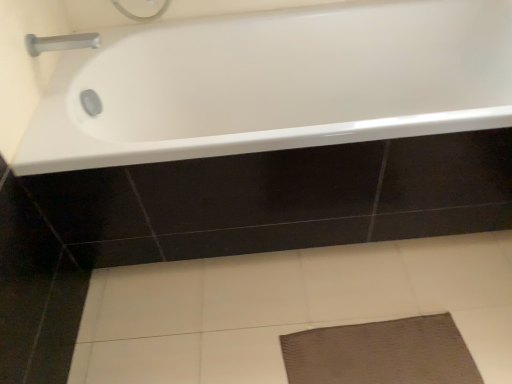
Question: Is white glossy bathtub at upper center in front of or behind silver metallic tap at upper left in the image?

Choices:
 (A) behind
 (B) front

Answer: (B)

Question: From a real-world perspective, is white glossy bathtub at upper center above or below silver metallic tap at upper left?

Choices:
 (A) above
 (B) below

Answer: (B)

Question: From the image's perspective, is white glossy bathtub at upper center positioned above or below silver metallic tap at upper left?

Choices:
 (A) above
 (B) below

Answer: (B)

Question: Considering the positions of silver metallic tap at upper left and white glossy bathtub at upper center in the image, is silver metallic tap at upper left wider or thinner than white glossy bathtub at upper center?

Choices:
 (A) thin
 (B) wide

Answer: (A)

Question: Considering their positions, is silver metallic tap at upper left located in front of or behind white glossy bathtub at upper center?

Choices:
 (A) front
 (B) behind

Answer: (B)

Question: Considering the relative positions of silver metallic tap at upper left and white glossy bathtub at upper center in the image provided, is silver metallic tap at upper left to the left or to the right of white glossy bathtub at upper center?

Choices:
 (A) left
 (B) right

Answer: (A)

Question: From a real-world perspective, relative to white glossy bathtub at upper center, is silver metallic tap at upper left vertically above or below?

Choices:
 (A) above
 (B) below

Answer: (A)